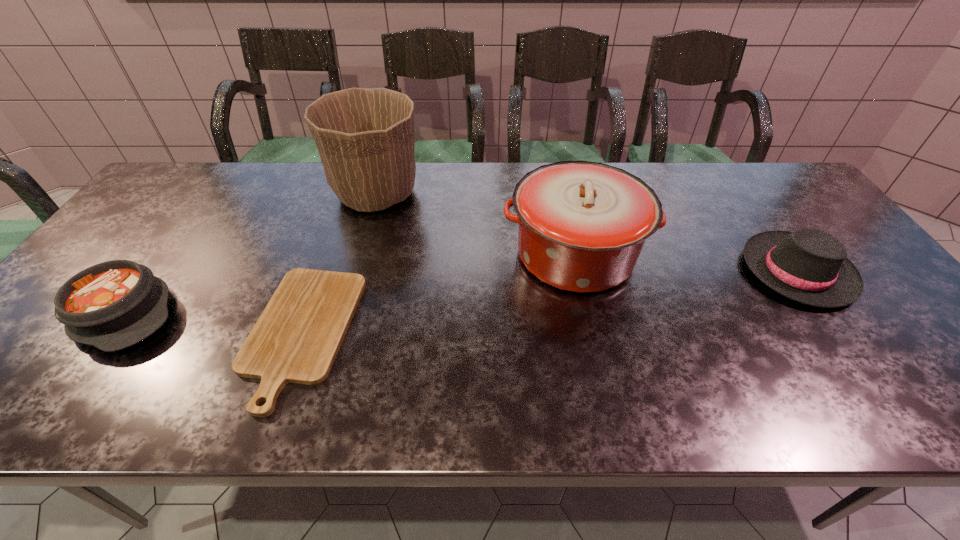
Where is `the tallest object`? the tallest object is located at coordinates (365, 137).

In order to click on the right casserole in this screenshot , I will do (x=582, y=225).

The height and width of the screenshot is (540, 960). Find the location of `the taller casserole`. the taller casserole is located at coordinates (582, 225).

You are a GUI agent. You are given a task and a screenshot of the screen. Output one action in this format:
    pyautogui.click(x=<x>, y=<y>)
    Task: Click on the rightmost object
    
    Given the screenshot: What is the action you would take?
    pyautogui.click(x=810, y=266)

I want to click on the shorter casserole, so click(112, 305).

The width and height of the screenshot is (960, 540). In order to click on the left casserole in this screenshot , I will do `click(112, 305)`.

The height and width of the screenshot is (540, 960). Find the location of `chopping board`. chopping board is located at coordinates (296, 339).

Find the location of `free spot located 0.160m on the left of the tallest object`. free spot located 0.160m on the left of the tallest object is located at coordinates (279, 193).

Find the location of `vacant area situated on the left of the fourth object from left to right`. vacant area situated on the left of the fourth object from left to right is located at coordinates (363, 254).

What are the coordinates of `blank space located 0.140m on the left of the rightmost object` in the screenshot? It's located at (690, 271).